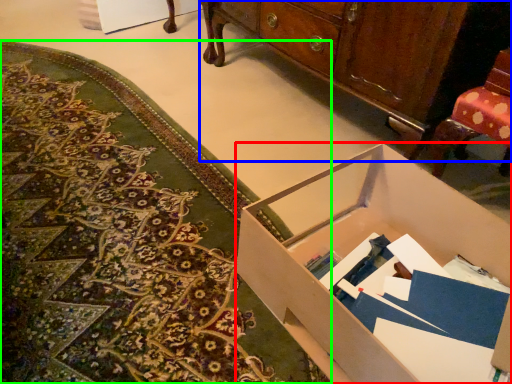
Question: Which is nearer to the desk (highlighted by a red box)? cabinetry (highlighted by a blue box) or mat (highlighted by a green box).

Choices:
 (A) cabinetry
 (B) mat

Answer: (B)